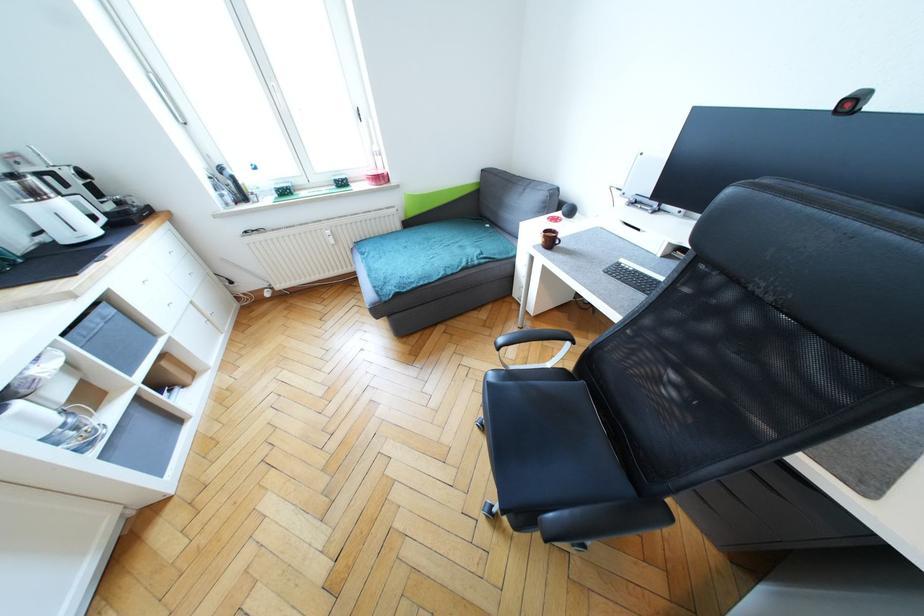
The height and width of the screenshot is (616, 924). What are the coordinates of `sofa sitting surface` in the screenshot? It's located at (429, 253).